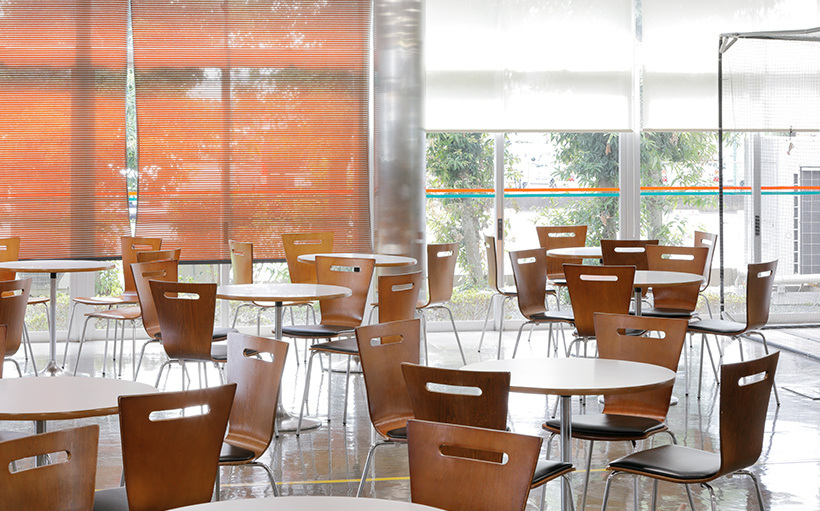
What are the coordinates of `blinds` in the screenshot? It's located at (64, 92), (266, 111), (531, 75), (659, 69).